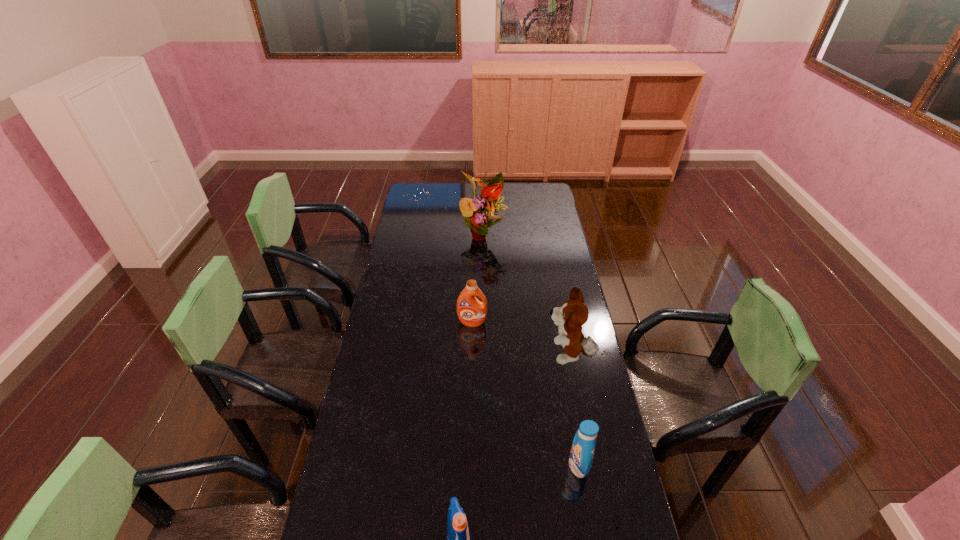
Find the location of a particular element. The height and width of the screenshot is (540, 960). bouquet is located at coordinates (485, 206).

You are a GUI agent. You are given a task and a screenshot of the screen. Output one action in this format:
    pyautogui.click(x=<x>, y=<y>)
    Task: Click on the third nearest object
    The height and width of the screenshot is (540, 960).
    Given the screenshot: What is the action you would take?
    pyautogui.click(x=570, y=317)

The height and width of the screenshot is (540, 960). Identify the location of puppy. (570, 317).

Locate an element on the screen. the second farthest object is located at coordinates (471, 312).

Where is `the second nearest object`? The image size is (960, 540). the second nearest object is located at coordinates tap(582, 451).

Locate an element on the screen. The height and width of the screenshot is (540, 960). the rightmost detergent is located at coordinates (582, 451).

Where is `free location located on the front-facing side of the bouquet`? The height and width of the screenshot is (540, 960). free location located on the front-facing side of the bouquet is located at coordinates (484, 266).

The height and width of the screenshot is (540, 960). Identify the location of vacant position located on the face of the fourth shortest object. (470, 355).

This screenshot has width=960, height=540. I want to click on free space located 0.360m on the face of the fourth shortest object, so click(449, 355).

Where is `free spot located 0.300m on the face of the fourth shortest object`? The height and width of the screenshot is (540, 960). free spot located 0.300m on the face of the fourth shortest object is located at coordinates (465, 355).